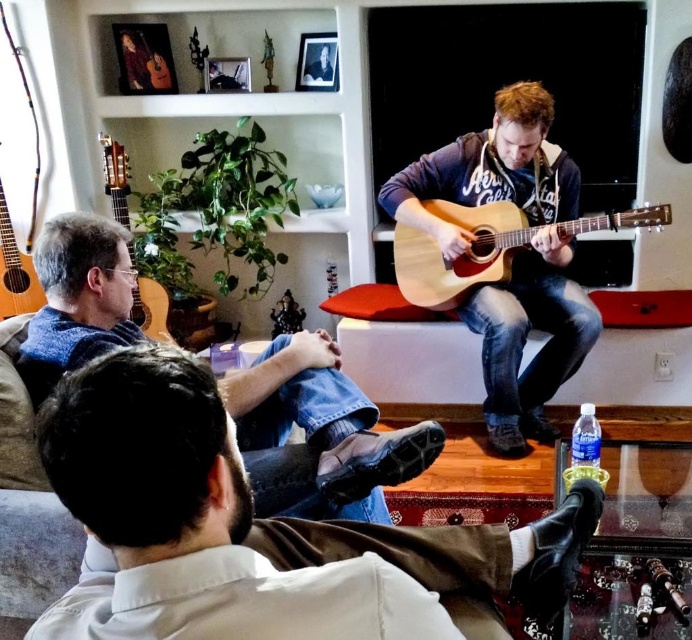
Can you confirm if matte blue hoodie at center is taller than light brown wood guitar at left?

Indeed, matte blue hoodie at center has a greater height compared to light brown wood guitar at left.

Between matte blue hoodie at center and light brown wood guitar at left, which one appears on the left side from the viewer's perspective?

From the viewer's perspective, light brown wood guitar at left appears more on the left side.

Locate an element on the screen. The width and height of the screenshot is (692, 640). matte blue hoodie at center is located at coordinates click(x=513, y=257).

Identify the location of matte blue hoodie at center. The width and height of the screenshot is (692, 640). (513, 257).

Who is lower down, light brown wood guitar at left or light brown wood acoustic guitar at left?

light brown wood acoustic guitar at left is below.

Is point (163, 314) farther from viewer compared to point (10, 241)?

No.

This screenshot has height=640, width=692. Identify the location of light brown wood guitar at left. (152, 308).

Image resolution: width=692 pixels, height=640 pixels. I want to click on light brown wood guitar at left, so click(x=152, y=308).

Can you confirm if brown leather jacket at lower center is thinner than blue denim jeans at lower left?

Incorrect, brown leather jacket at lower center's width is not less than blue denim jeans at lower left's.

Who is lower down, brown leather jacket at lower center or blue denim jeans at lower left?

brown leather jacket at lower center

Locate an element on the screen. brown leather jacket at lower center is located at coordinates (253, 529).